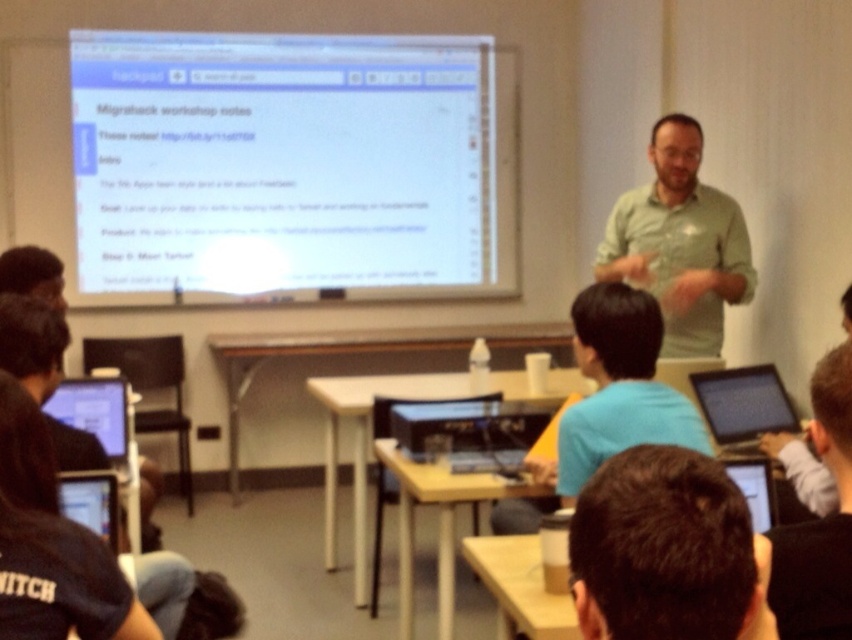
Question: Is brown hair at center above green matte shirt at center?

Choices:
 (A) no
 (B) yes

Answer: (A)

Question: Is green matte shirt at center wider than black glossy laptop at lower right?

Choices:
 (A) no
 (B) yes

Answer: (B)

Question: Among these points, which one is farthest from the camera?

Choices:
 (A) (654, 248)
 (B) (107, 401)
 (C) (715, 579)

Answer: (A)

Question: Which object is the farthest from the matte black laptop at lower left?

Choices:
 (A) white matte screen at upper center
 (B) light blue shirt at upper right
 (C) brown hair at center

Answer: (A)

Question: Observing the image, what is the correct spatial positioning of blue shirt at center in reference to light blue shirt at upper right?

Choices:
 (A) below
 (B) above

Answer: (B)

Question: Which of the following is the farthest from the observer?

Choices:
 (A) green matte shirt at center
 (B) brown hair at center
 (C) blue shirt at center
 (D) black glossy laptop at lower right

Answer: (A)